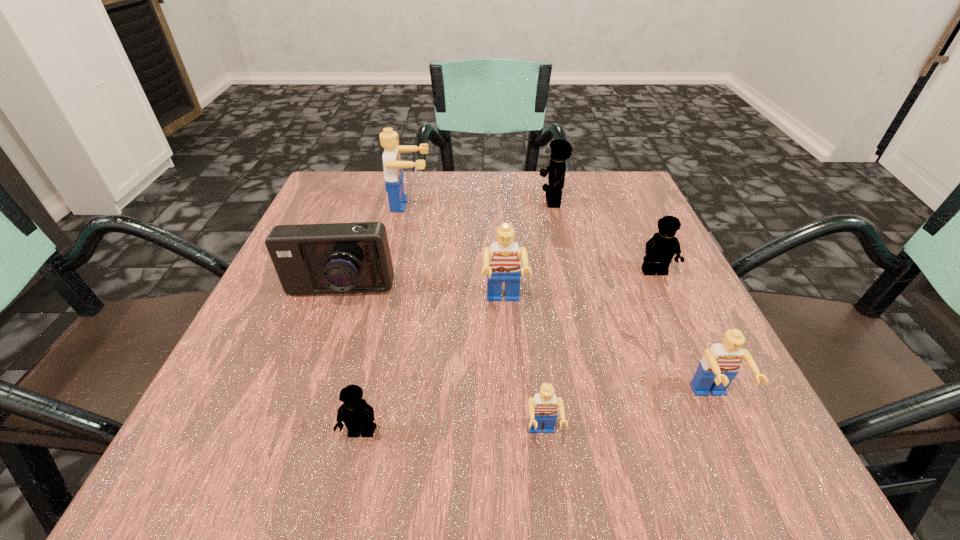
Image resolution: width=960 pixels, height=540 pixels. I want to click on the second closest Lego to the smallest blue Lego, so click(358, 416).

I want to click on Lego that is the closest one to the third farthest Lego, so click(x=561, y=150).

Where is `the closest blue Lego to the rightmost blue Lego`? the closest blue Lego to the rightmost blue Lego is located at coordinates (543, 408).

Identify which blue Lego is the third nearest to the sixth farthest object. Please provide its 2D coordinates. Your answer should be formatted as a tuple, i.e. [(x, y)], where the tuple contains the x and y coordinates of a point satisfying the conditions above.

[(393, 167)]

Locate which yellow Lego ranks third in proximity to the smallest blue Lego. Please provide its 2D coordinates. Your answer should be formatted as a tuple, i.e. [(x, y)], where the tuple contains the x and y coordinates of a point satisfying the conditions above.

[(561, 150)]

Find the location of a particular element. the second closest yellow Lego to the smallest yellow Lego is located at coordinates (561, 150).

Image resolution: width=960 pixels, height=540 pixels. I want to click on vacant position in the image that satisfies the following two spatial constraints: 1. on the front-facing side of the second yellow Lego from right to left; 2. on the front-facing side of the leftmost yellow Lego, so click(605, 433).